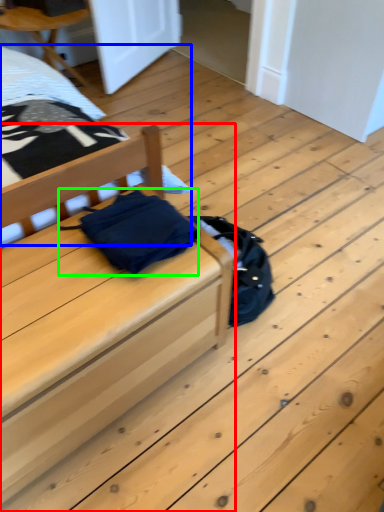
Question: Based on their relative distances, which object is farther from furniture (highlighted by a red box)? Choose from bed (highlighted by a blue box) and material (highlighted by a green box).

Choices:
 (A) bed
 (B) material

Answer: (A)